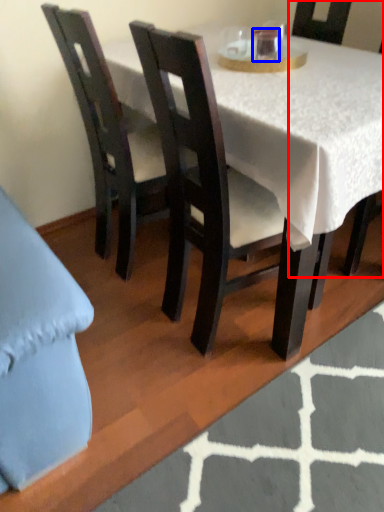
Question: Which object is further to the camera taking this photo, chair (highlighted by a red box) or coffee cup (highlighted by a blue box)?

Choices:
 (A) chair
 (B) coffee cup

Answer: (B)